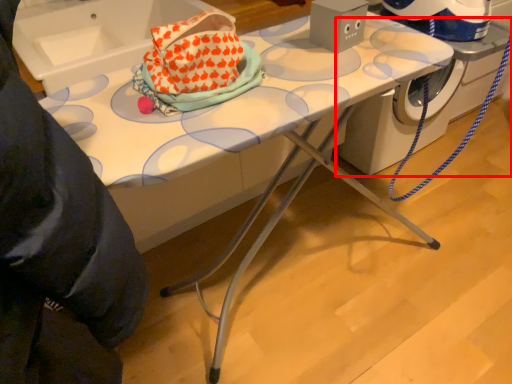
Question: From the image's perspective, where is machine (annotated by the red box) located in relation to sink in the image?

Choices:
 (A) below
 (B) above

Answer: (A)